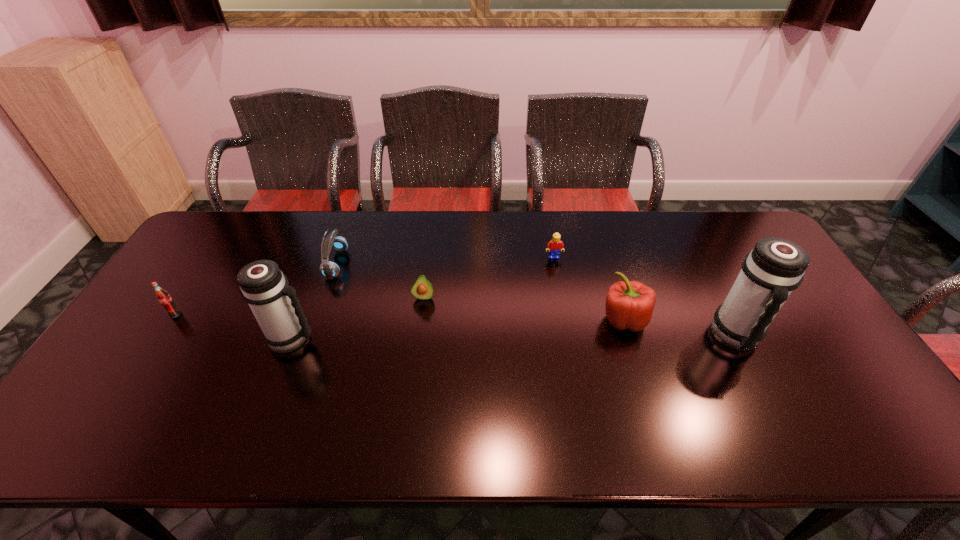
Where is `free location that satisfies the following two spatial constraints: 1. on the ear cups of the headset; 2. on the label of the soda bottle`? The width and height of the screenshot is (960, 540). free location that satisfies the following two spatial constraints: 1. on the ear cups of the headset; 2. on the label of the soda bottle is located at coordinates (319, 314).

The image size is (960, 540). Find the location of `vacant point that satisfies the following two spatial constraints: 1. on the cut side of the avocado; 2. on the side with the handle of the shorter thermos bottle`. vacant point that satisfies the following two spatial constraints: 1. on the cut side of the avocado; 2. on the side with the handle of the shorter thermos bottle is located at coordinates (419, 338).

The height and width of the screenshot is (540, 960). I want to click on free region that satisfies the following two spatial constraints: 1. on the front-facing side of the fifth object from left to right; 2. on the side with the handle of the second tallest object, so click(x=568, y=338).

This screenshot has width=960, height=540. What are the coordinates of `vacant space that satisfies the following two spatial constraints: 1. on the front-facing side of the Lego; 2. on the side with the handle of the second tallest object` in the screenshot? It's located at (568, 338).